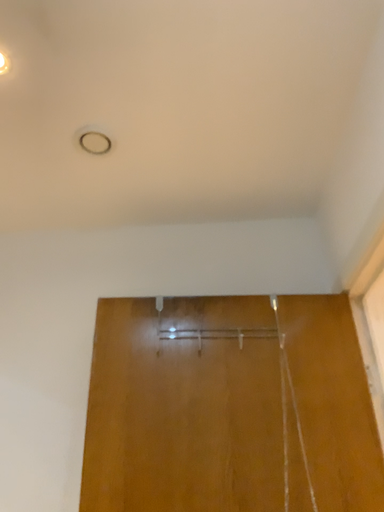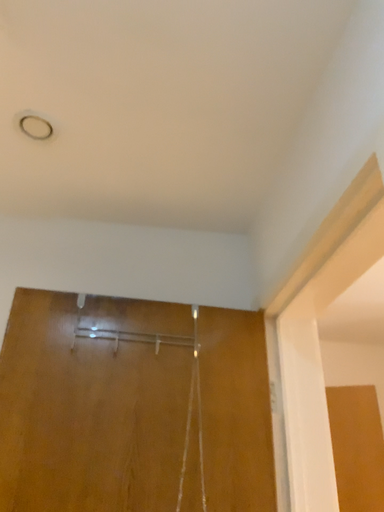
Question: Which way did the camera rotate in the video?

Choices:
 (A) rotated left
 (B) rotated right

Answer: (B)